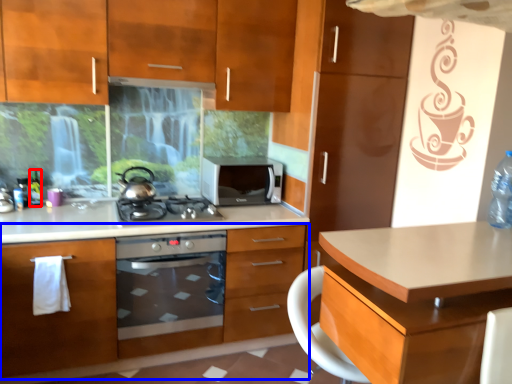
Question: Which point is further to the camera, bottle (highlighted by a red box) or cabinetry (highlighted by a blue box)?

Choices:
 (A) bottle
 (B) cabinetry

Answer: (A)